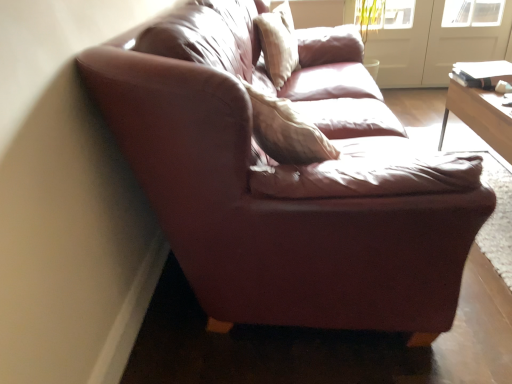
Question: In the image, is light beige fabric pillow at upper center positioned in front of or behind transparent glass screen door at upper right, which appears as the 1th screen door when viewed from the right?

Choices:
 (A) behind
 (B) front

Answer: (B)

Question: From a real-world perspective, is light beige fabric pillow at upper center physically located above or below transparent glass screen door at upper right, which is the second screen door from left to right?

Choices:
 (A) above
 (B) below

Answer: (A)

Question: Estimate the real-world distances between objects in this image. Which object is farther from the light beige fabric pillow at upper center?

Choices:
 (A) white glossy screen door at upper right, the second screen door viewed from the right
 (B) transparent glass screen door at upper right, which appears as the 1th screen door when viewed from the right

Answer: (B)

Question: Which is nearer to the light beige fabric pillow at upper center?

Choices:
 (A) white glossy screen door at upper right, arranged as the 1th screen door when viewed from the left
 (B) transparent glass screen door at upper right, which appears as the 1th screen door when viewed from the right

Answer: (A)